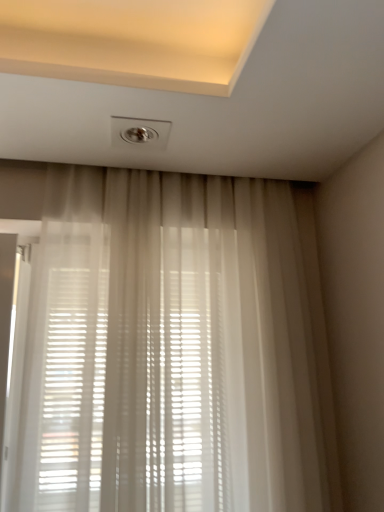
This screenshot has width=384, height=512. What are the coordinates of `sheer white curtain at center` in the screenshot? It's located at (180, 343).

The width and height of the screenshot is (384, 512). Describe the element at coordinates (180, 343) in the screenshot. I see `sheer white curtain at center` at that location.

I want to click on sheer white curtain at center, so click(180, 343).